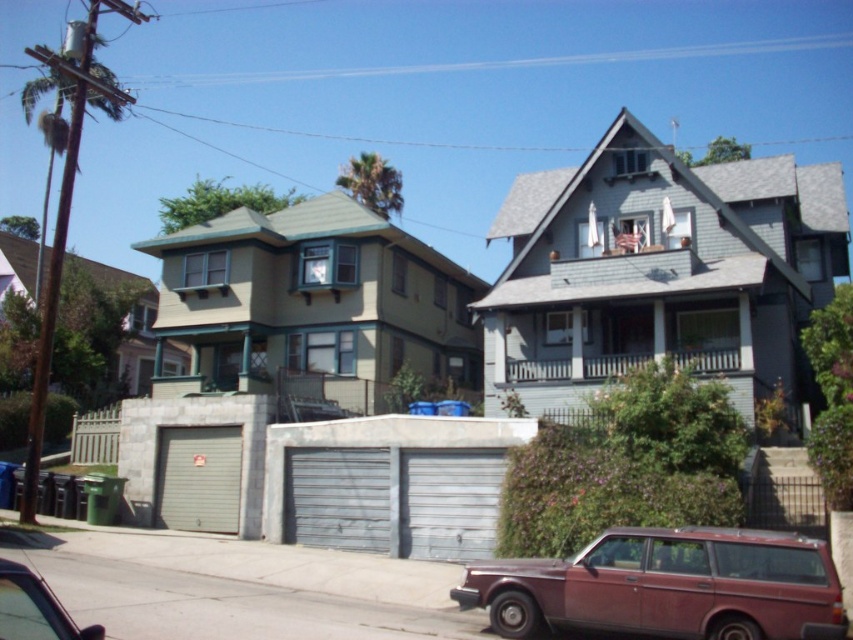
Can you confirm if gray wood garage at upper right is smaller than metallic red car at lower left?

No.

Where is `gray wood garage at upper right`? This screenshot has width=853, height=640. gray wood garage at upper right is located at coordinates (659, 272).

Which is behind, point (584, 204) or point (12, 572)?

The point (584, 204) is more distant.

Identify the location of gray wood garage at upper right. (659, 272).

This screenshot has height=640, width=853. I want to click on green wood garage at center, so click(x=314, y=305).

Does green wood garage at center lie behind rustic maroon station wagon at lower center?

Yes, it is behind rustic maroon station wagon at lower center.

Locate an element on the screen. green wood garage at center is located at coordinates [x=314, y=305].

Find the location of a particular element. The height and width of the screenshot is (640, 853). green wood garage at center is located at coordinates (314, 305).

Does gray wood garage at upper right appear on the left side of green wood garage at center?

Incorrect, gray wood garage at upper right is not on the left side of green wood garage at center.

Who is higher up, gray wood garage at upper right or green wood garage at center?

gray wood garage at upper right is above.

Does point (775, 205) come behind point (386, 337)?

No.

Where is `gray wood garage at upper right`? gray wood garage at upper right is located at coordinates (659, 272).